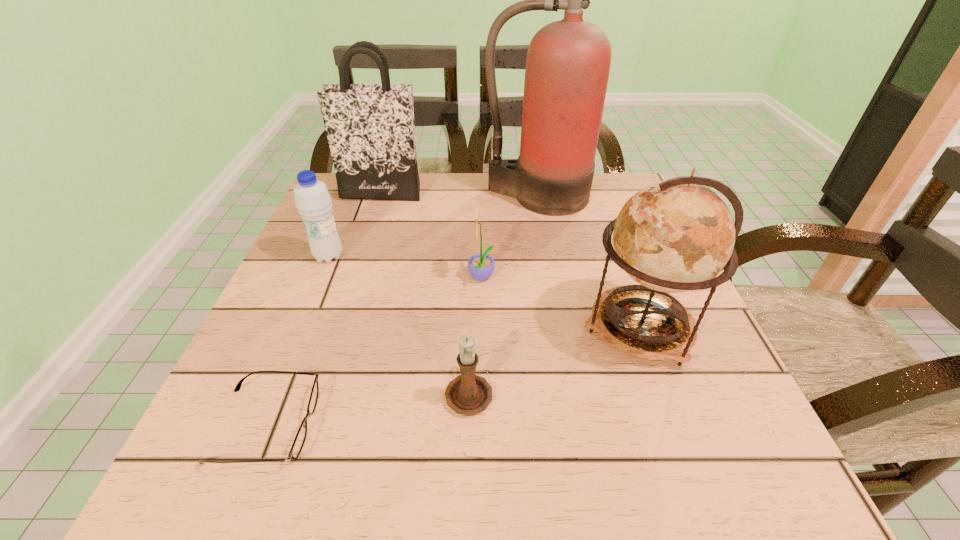
The image size is (960, 540). Identify the location of empty space that is in between the spectacles and the sunflower. (373, 352).

Where is `vacant area that lies between the globe and the fourth tallest object`? vacant area that lies between the globe and the fourth tallest object is located at coordinates (484, 292).

The height and width of the screenshot is (540, 960). In order to click on vacant region between the globe and the shopping bag in this screenshot , I will do `click(510, 260)`.

Where is `vacant region between the tallest object and the shopping bag`? The image size is (960, 540). vacant region between the tallest object and the shopping bag is located at coordinates (459, 194).

Find the location of `free space between the spectacles and the sunflower`. free space between the spectacles and the sunflower is located at coordinates (373, 352).

Locate an element on the screen. Image resolution: width=960 pixels, height=540 pixels. object that ranks as the fourth closest to the shopping bag is located at coordinates (676, 235).

The width and height of the screenshot is (960, 540). Find the location of `the fifth closest object to the fire extinguisher`. the fifth closest object to the fire extinguisher is located at coordinates (468, 394).

This screenshot has height=540, width=960. I want to click on free space that satisfies the following two spatial constraints: 1. at the nozzle of the tallest object; 2. on the front-facing side of the sunflower, so click(x=552, y=279).